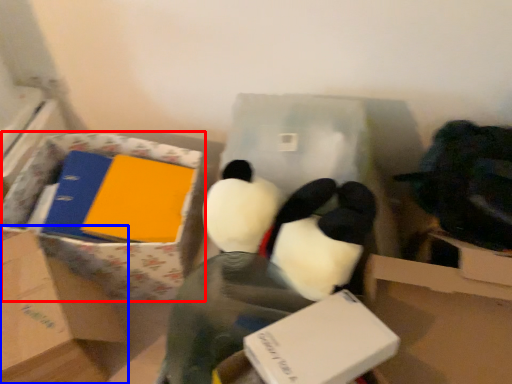
Question: Among these objects, which one is farthest to the camera, cardboard box (highlighted by a red box) or box (highlighted by a blue box)?

Choices:
 (A) cardboard box
 (B) box

Answer: (A)